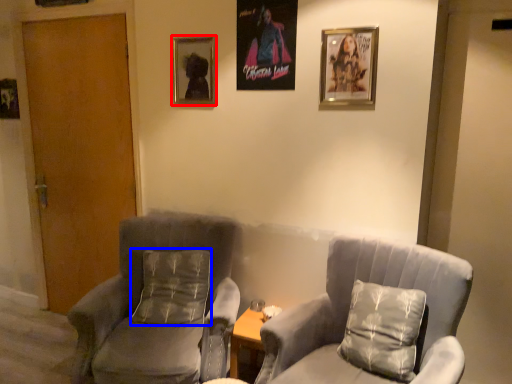
Question: Which object appears closest to the camera in this image, picture frame (highlighted by a red box) or pillow (highlighted by a blue box)?

Choices:
 (A) picture frame
 (B) pillow

Answer: (B)